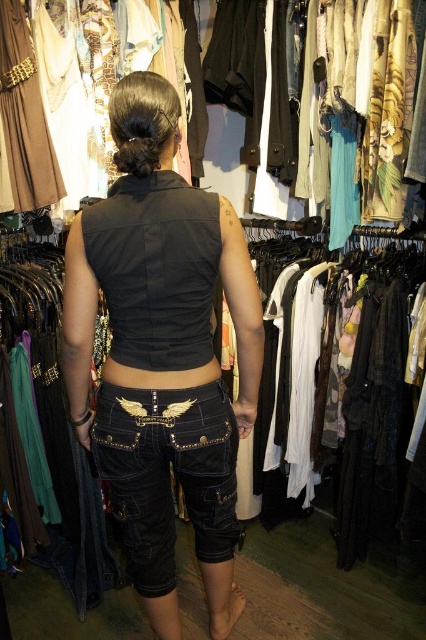
Question: Which object is positioned closest to the black leather belt at center?

Choices:
 (A) denim shorts at center
 (B) white sheer fabric at center

Answer: (A)

Question: Can you confirm if white sheer fabric at center is bigger than denim shorts at center?

Choices:
 (A) no
 (B) yes

Answer: (B)

Question: Can you confirm if denim shorts at center is positioned above black leather belt at center?

Choices:
 (A) no
 (B) yes

Answer: (A)

Question: Can you confirm if white sheer fabric at center is bigger than denim shorts at center?

Choices:
 (A) no
 (B) yes

Answer: (B)

Question: Which point is closer to the camera?

Choices:
 (A) denim shorts at center
 (B) white sheer fabric at center
 (C) black denim shorts at center

Answer: (C)

Question: Which point is farther to the camera?

Choices:
 (A) white sheer fabric at center
 (B) black denim shorts at center

Answer: (A)